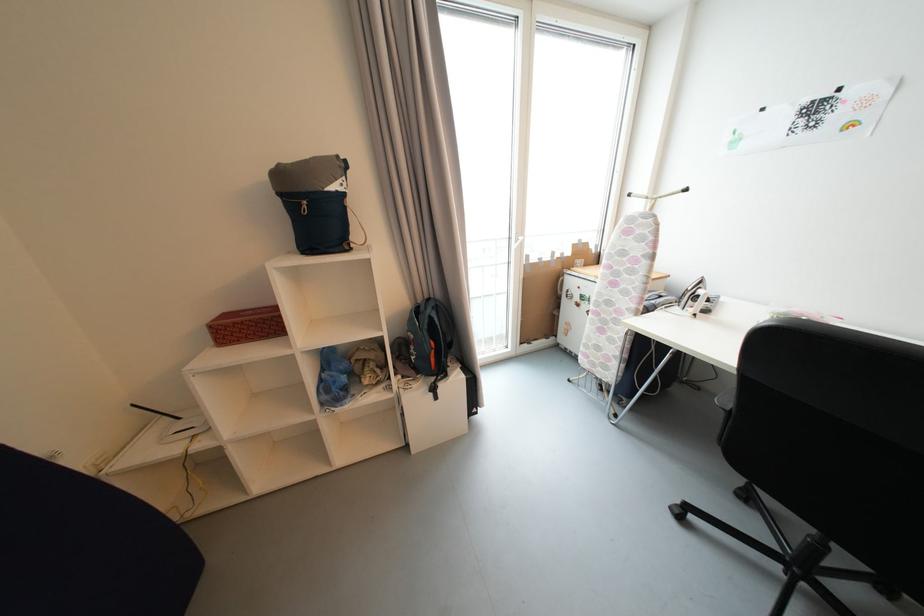
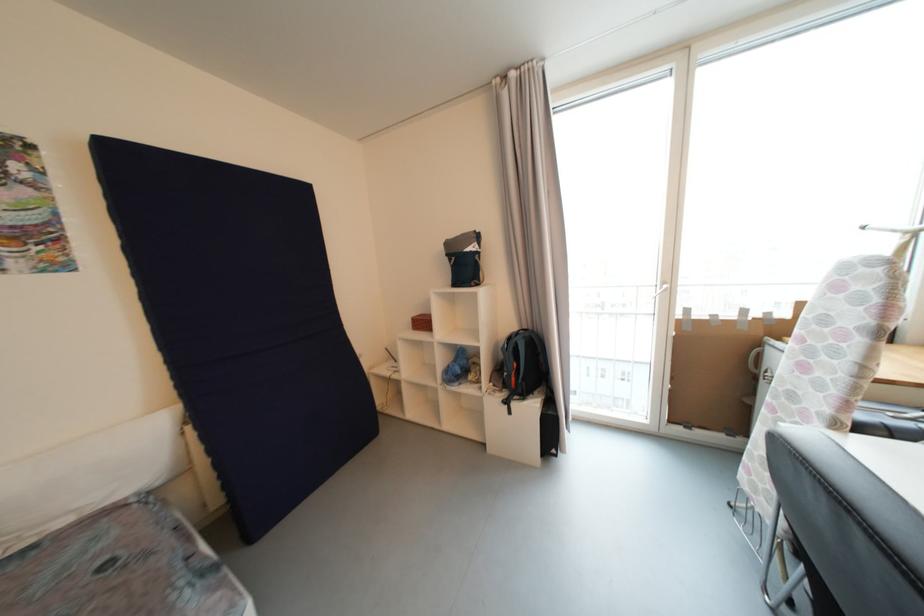
Question: The camera is either moving clockwise (left) or counter-clockwise (right) around the object. The first image is from the beginning of the video and the second image is from the end. Is the camera moving left or right when shooting the video?

Choices:
 (A) Left
 (B) Right

Answer: (B)